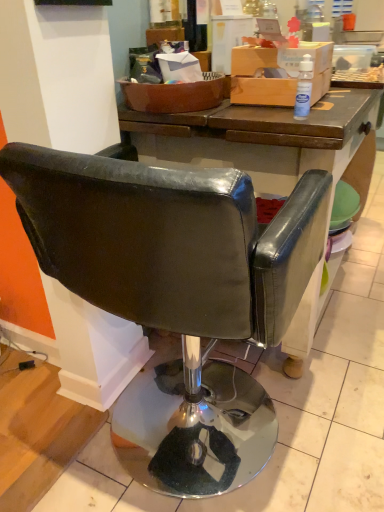
Locate an element on the screen. This screenshot has width=384, height=512. vacant space to the left of transparent plastic bottle at upper right is located at coordinates (245, 118).